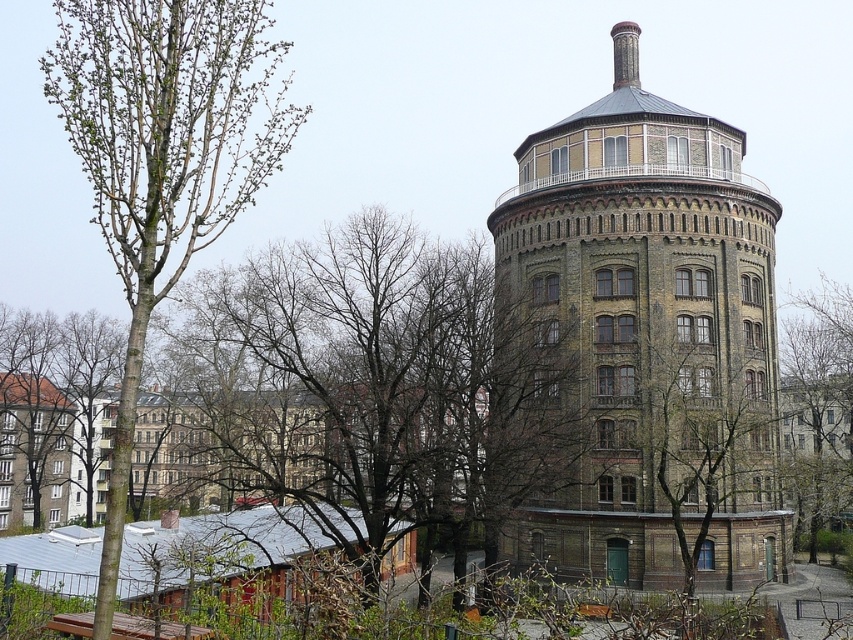
Question: Is bare branches at left to the right of green leafy tree at center from the viewer's perspective?

Choices:
 (A) no
 (B) yes

Answer: (A)

Question: Among these objects, which one is farthest from the camera?

Choices:
 (A) green leafy tree at upper right
 (B) bare branches at left
 (C) green leafy tree at left
 (D) green leafy tree at center

Answer: (A)

Question: Which of the following is the closest to the observer?

Choices:
 (A) green leafy tree at upper right
 (B) green leafy tree at center
 (C) bare branches at left

Answer: (C)

Question: Can you confirm if brown brick tower at right is smaller than green leafy tree at left?

Choices:
 (A) yes
 (B) no

Answer: (A)

Question: Which point is farther to the camera?

Choices:
 (A) (704, 467)
 (B) (787, 442)
 (C) (131, 353)
 (D) (390, 387)

Answer: (B)

Question: Can you confirm if brown brick tower at right is wider than bare branches at left?

Choices:
 (A) no
 (B) yes

Answer: (A)